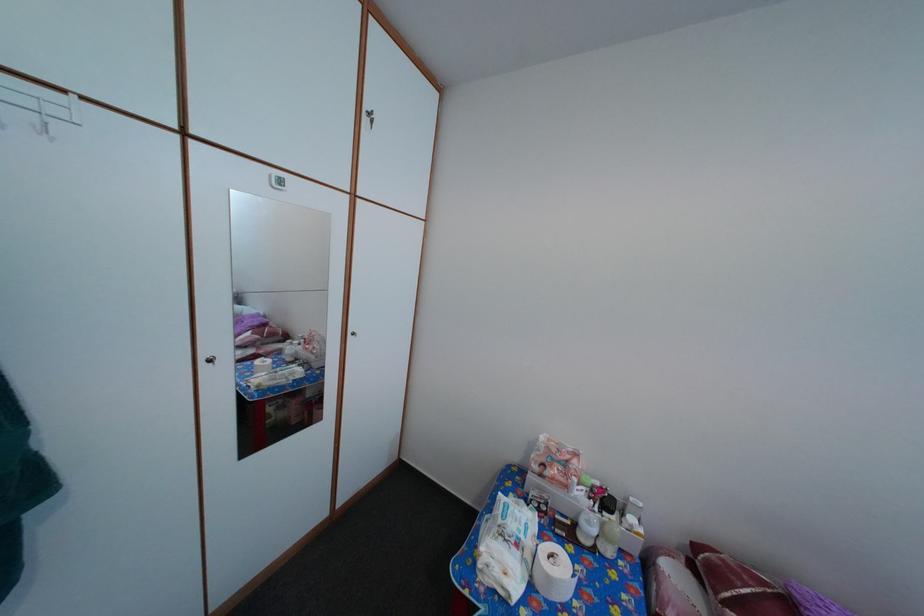
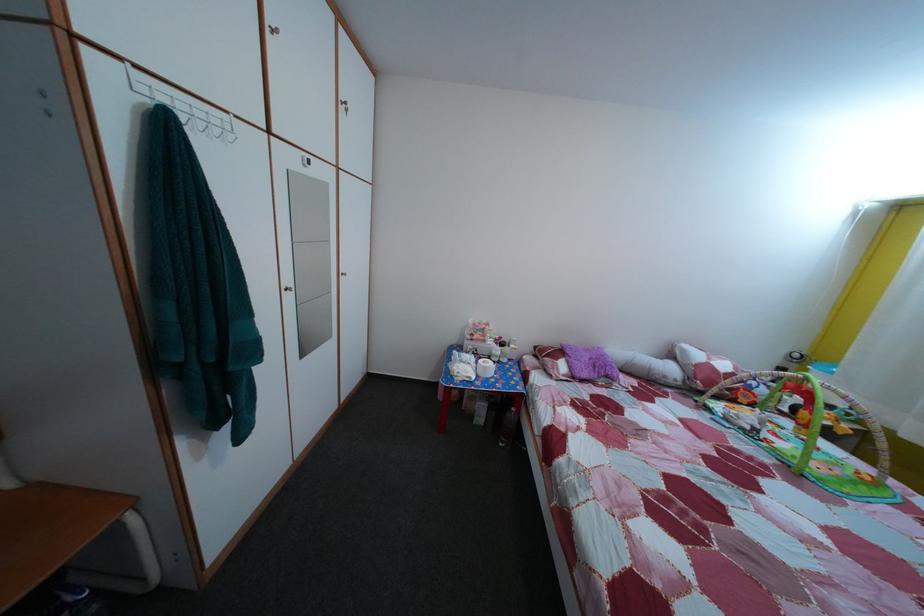
The images are taken continuously from a first-person perspective. In which direction are you moving?

The movement direction of the cameraman is left, backward.